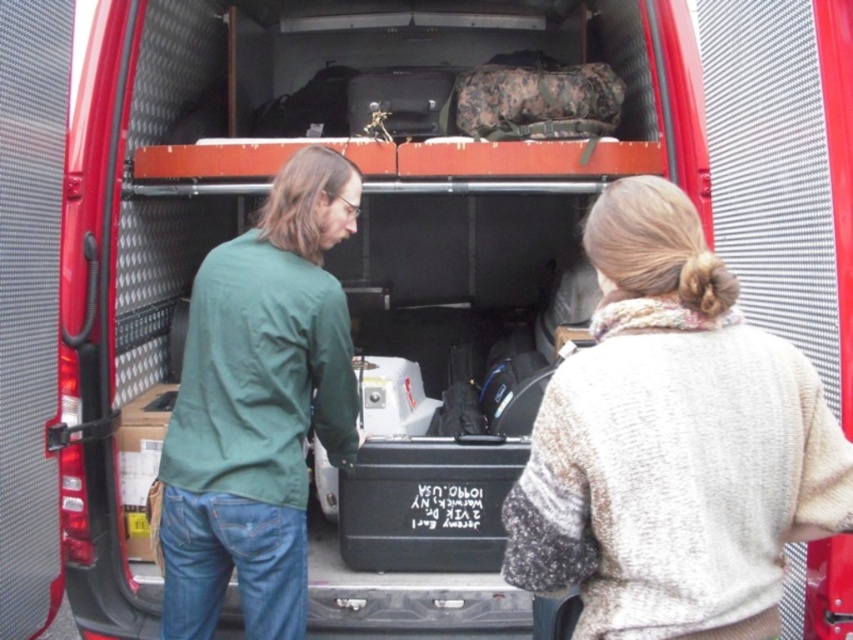
Is green matte shirt at center bigger than green matte jacket at center?

Yes, green matte shirt at center is bigger than green matte jacket at center.

Who is shorter, green matte shirt at center or green matte jacket at center?

With less height is green matte jacket at center.

The width and height of the screenshot is (853, 640). I want to click on green matte shirt at center, so click(258, 406).

Does knitted beige sweater at center appear on the left side of green matte jacket at center?

No, knitted beige sweater at center is not to the left of green matte jacket at center.

Does knitted beige sweater at center have a larger size compared to green matte jacket at center?

Actually, knitted beige sweater at center might be smaller than green matte jacket at center.

Measure the distance between knitted beige sweater at center and camera.

knitted beige sweater at center and camera are 5.40 feet apart from each other.

The image size is (853, 640). Find the location of `knitted beige sweater at center`. knitted beige sweater at center is located at coordinates (672, 444).

From the picture: Does knitted beige sweater at center appear on the right side of green matte shirt at center?

Correct, you'll find knitted beige sweater at center to the right of green matte shirt at center.

Who is more distant from viewer, (646, 481) or (190, 396)?

The point (190, 396) is behind.

Image resolution: width=853 pixels, height=640 pixels. Describe the element at coordinates (672, 444) in the screenshot. I see `knitted beige sweater at center` at that location.

Identify the location of knitted beige sweater at center. The height and width of the screenshot is (640, 853). (672, 444).